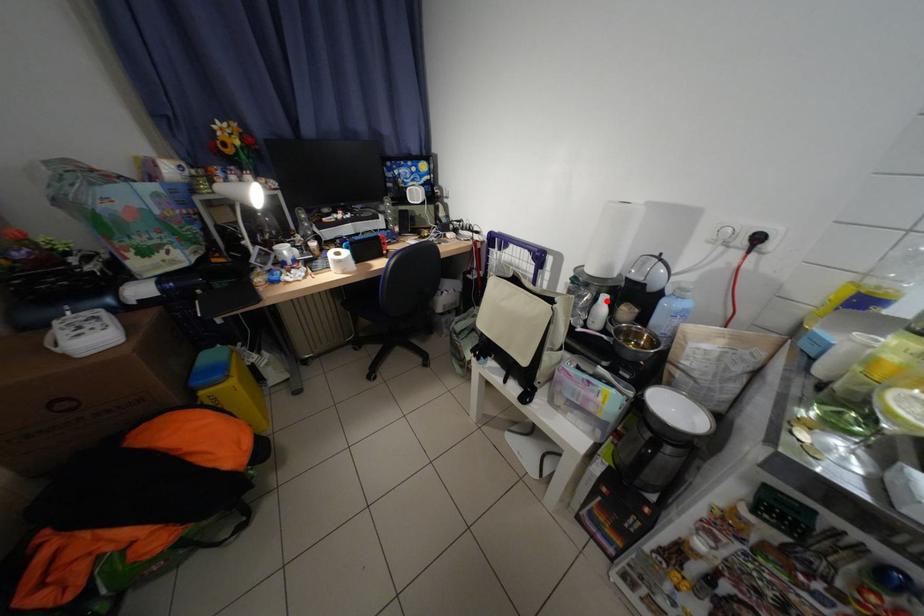
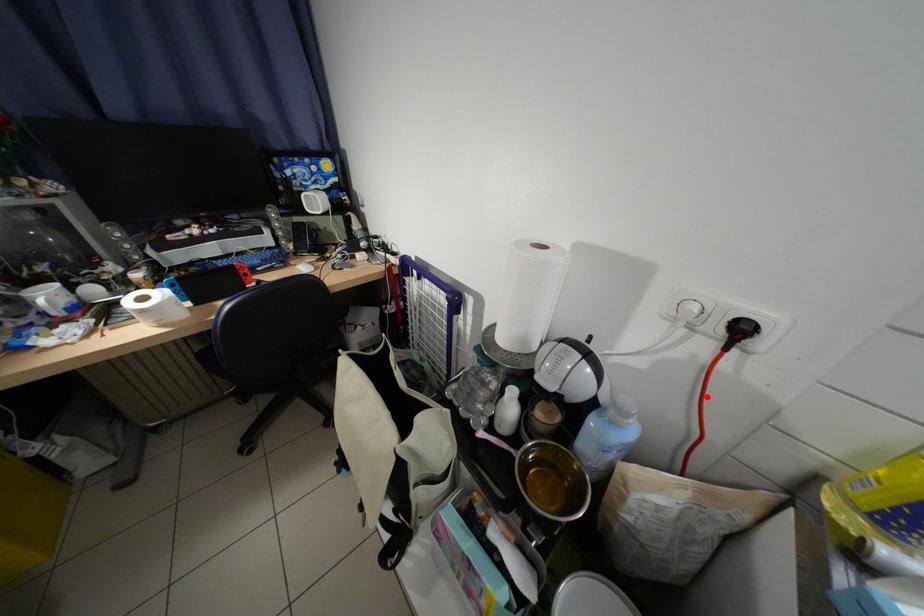
I am providing you with two images of the same scene from different viewpoints. A red point is marked on the first image and another point is marked on the second image. Are the points marked in image1 and image2 representing the same 3D position?

No